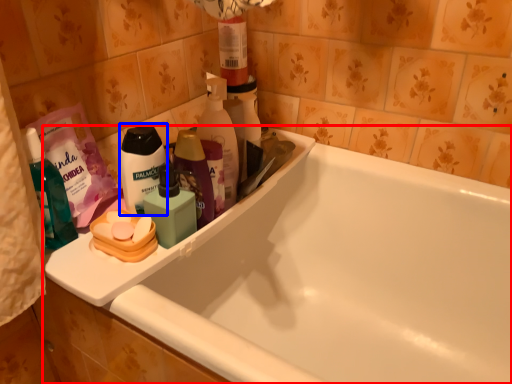
Question: Among these objects, which one is farthest to the camera, bathtub (highlighted by a red box) or personal care (highlighted by a blue box)?

Choices:
 (A) bathtub
 (B) personal care

Answer: (B)